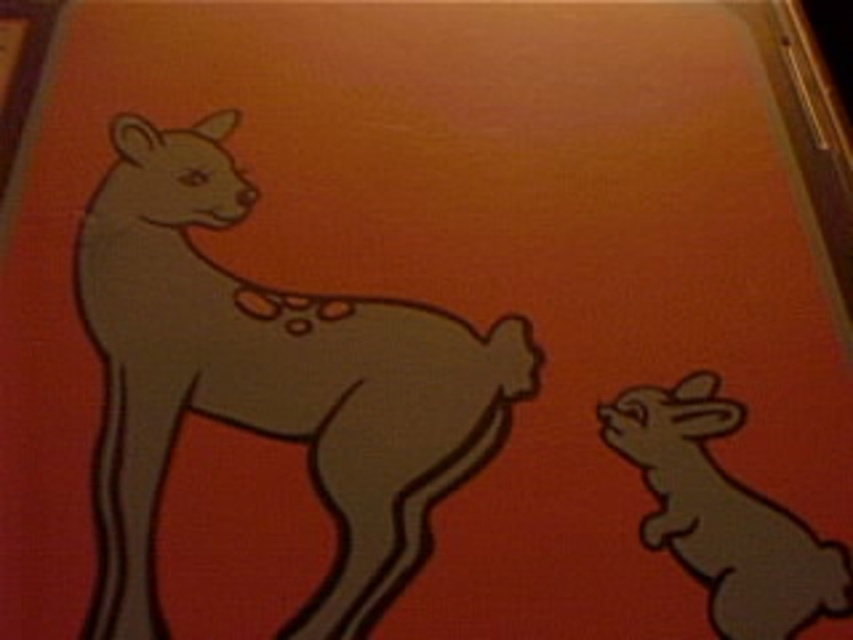
Question: Can you confirm if matte brown kangaroo at left is bigger than matte gray rabbit at lower right?

Choices:
 (A) no
 (B) yes

Answer: (B)

Question: Does matte brown kangaroo at left come in front of matte gray rabbit at lower right?

Choices:
 (A) no
 (B) yes

Answer: (B)

Question: Is matte brown kangaroo at left wider than matte gray rabbit at lower right?

Choices:
 (A) yes
 (B) no

Answer: (A)

Question: Which point is closer to the camera taking this photo?

Choices:
 (A) (161, 625)
 (B) (811, 614)

Answer: (A)